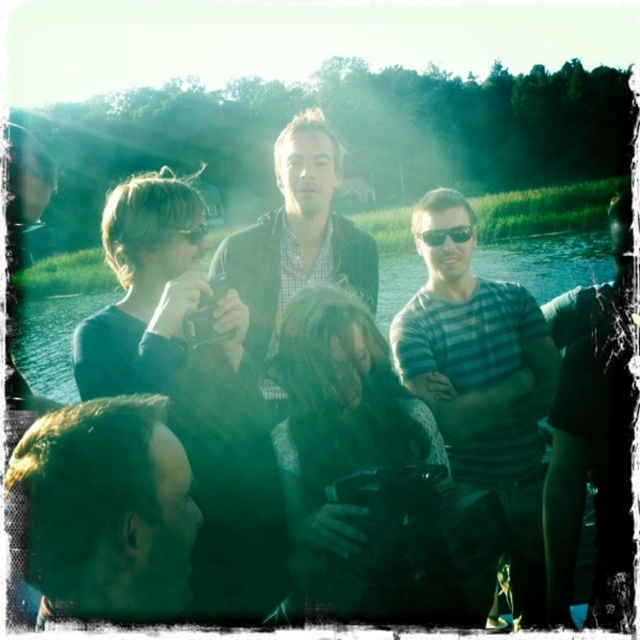
Question: Is matte black jacket at center bigger than greenish water at center?

Choices:
 (A) yes
 (B) no

Answer: (B)

Question: Which of these objects is positioned closest to the dark hair at center?

Choices:
 (A) greenish water at center
 (B) clear plastic sunglasses at center
 (C) striped cotton shirt at center

Answer: (B)

Question: Which point is farther to the camera?

Choices:
 (A) dark hair at center
 (B) striped cotton shirt at center

Answer: (B)

Question: Does dark hair at center appear on the right side of clear plastic sunglasses at center?

Choices:
 (A) yes
 (B) no

Answer: (B)

Question: Which object is positioned farthest from the clear plastic sunglasses at center?

Choices:
 (A) matte black jacket at center
 (B) dark hair at center
 (C) striped cotton shirt at center
 (D) greenish water at center

Answer: (D)

Question: Is the position of striped cotton shirt at center less distant than that of greenish water at center?

Choices:
 (A) yes
 (B) no

Answer: (A)